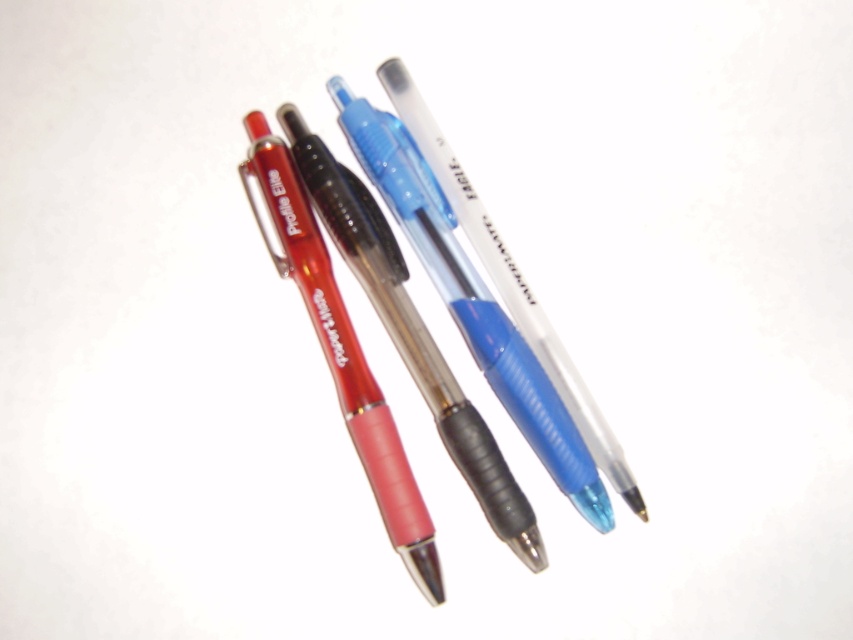
Which of these two, translucent plastic pen at center or translucent plastic pen at upper left, stands shorter?

translucent plastic pen at center is shorter.

Who is more forward, (469, 340) or (398, 540)?

Point (398, 540) is more forward.

The image size is (853, 640). What are the coordinates of `translucent plastic pen at center` in the screenshot? It's located at (471, 300).